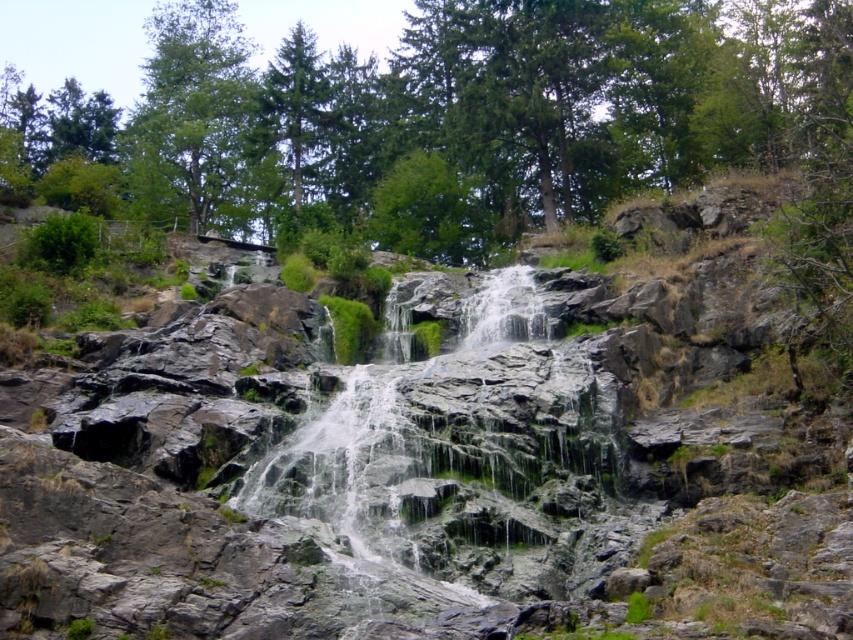
Between green mossy rocks at center and green leafy tree at upper left, which one appears on the right side from the viewer's perspective?

Positioned to the right is green mossy rocks at center.

Does green mossy rocks at center come behind green leafy tree at upper left?

No, it is not.

Which is behind, point (102, 627) or point (241, 65)?

The point (241, 65) is more distant.

You are a GUI agent. You are given a task and a screenshot of the screen. Output one action in this format:
    pyautogui.click(x=<x>, y=<y>)
    Task: Click on the green mossy rocks at center
    The width and height of the screenshot is (853, 640).
    Given the screenshot: What is the action you would take?
    pyautogui.click(x=439, y=460)

Can you confirm if green mossy rock at center is positioned to the right of green leafy tree at upper left?

Indeed, green mossy rock at center is positioned on the right side of green leafy tree at upper left.

Describe the element at coordinates (463, 452) in the screenshot. The width and height of the screenshot is (853, 640). I see `green mossy rock at center` at that location.

Find the location of `green mossy rock at center`. green mossy rock at center is located at coordinates (463, 452).

Between green mossy rocks at center and green mossy rock at center, which one has more height?

With more height is green mossy rocks at center.

Can you confirm if green mossy rocks at center is positioned above green mossy rock at center?

Yes, green mossy rocks at center is above green mossy rock at center.

This screenshot has width=853, height=640. What do you see at coordinates (439, 460) in the screenshot?
I see `green mossy rocks at center` at bounding box center [439, 460].

Where is `green mossy rocks at center`? The width and height of the screenshot is (853, 640). green mossy rocks at center is located at coordinates point(439,460).